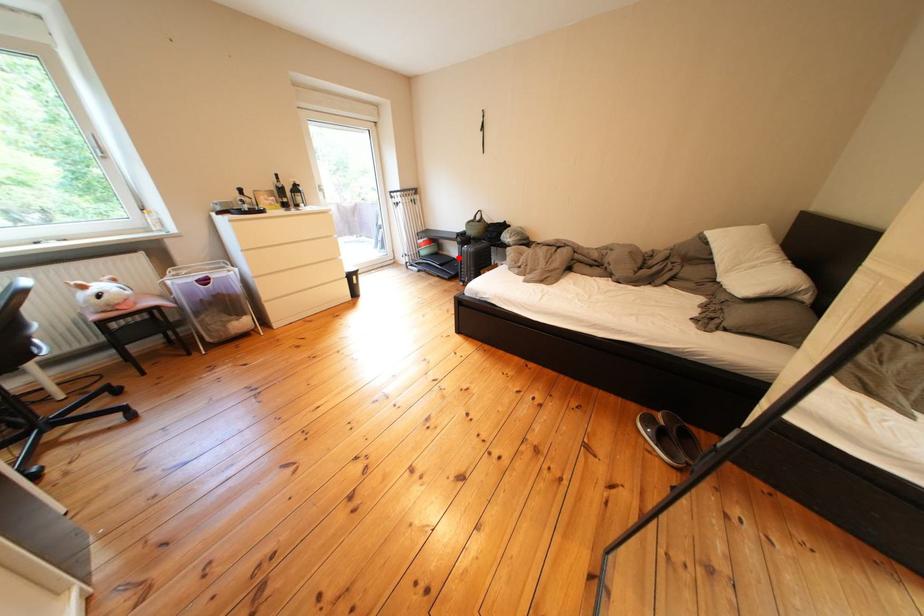
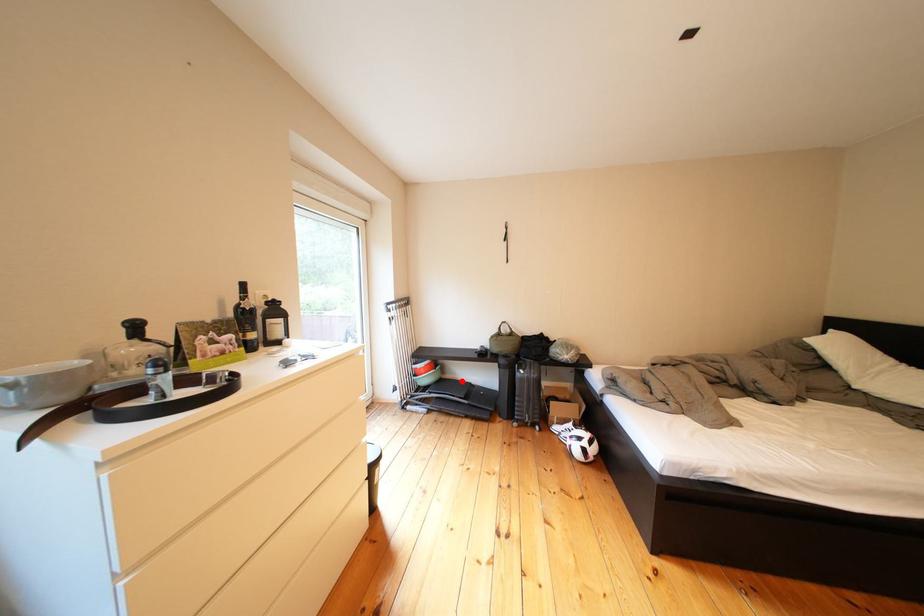
I am providing you with two images of the same scene from different viewpoints. A red point is marked on the first image and another point is marked on the second image. Is the red point in image1 aligned with the point shown in image2?

Yes